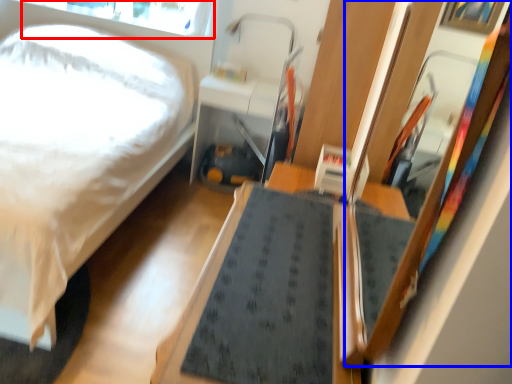
Question: Among these objects, which one is nearest to the camera, window screen (highlighted by a red box) or mirror (highlighted by a blue box)?

Choices:
 (A) window screen
 (B) mirror

Answer: (B)